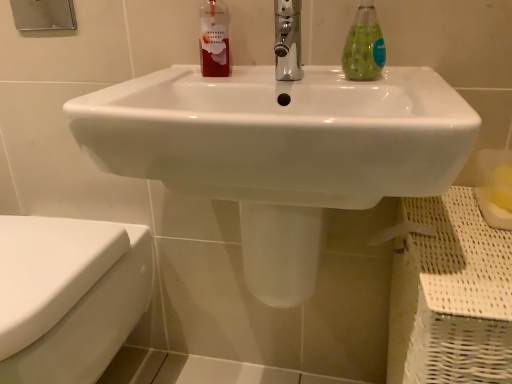
The width and height of the screenshot is (512, 384). In order to click on free space in front of matte plastic bottle at upper center in this screenshot , I will do `click(195, 81)`.